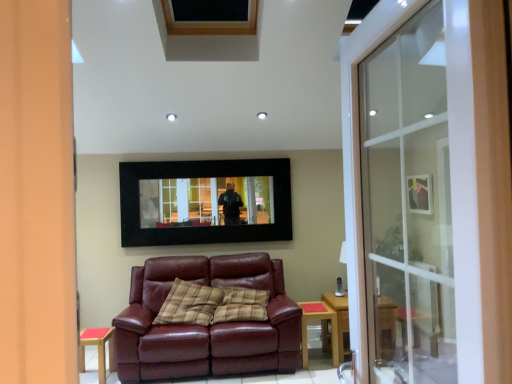
Find the location of a particular element. The image size is (512, 384). free location above black matte picture frame at center, which appears as the second picture frame when viewed from the right (from a real-world perspective) is located at coordinates (209, 156).